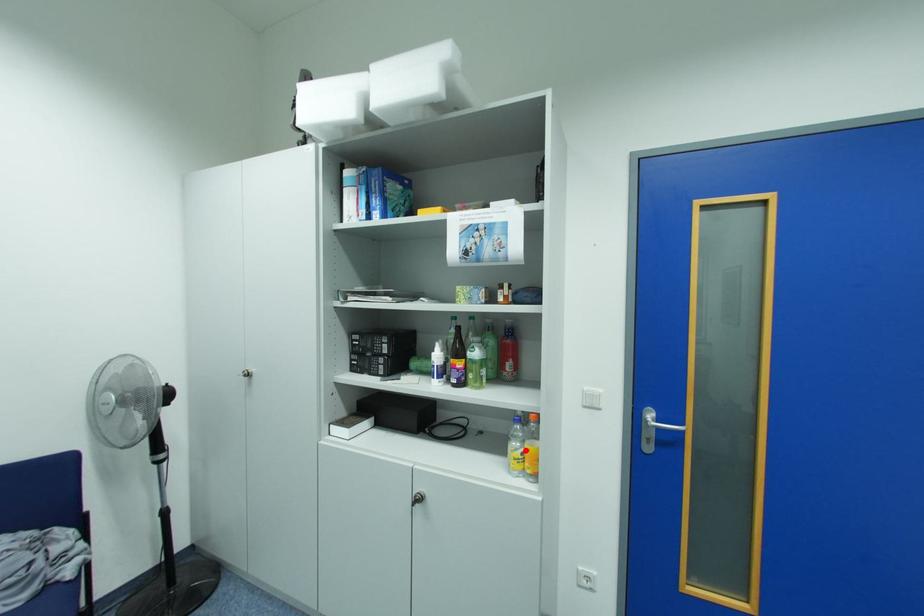
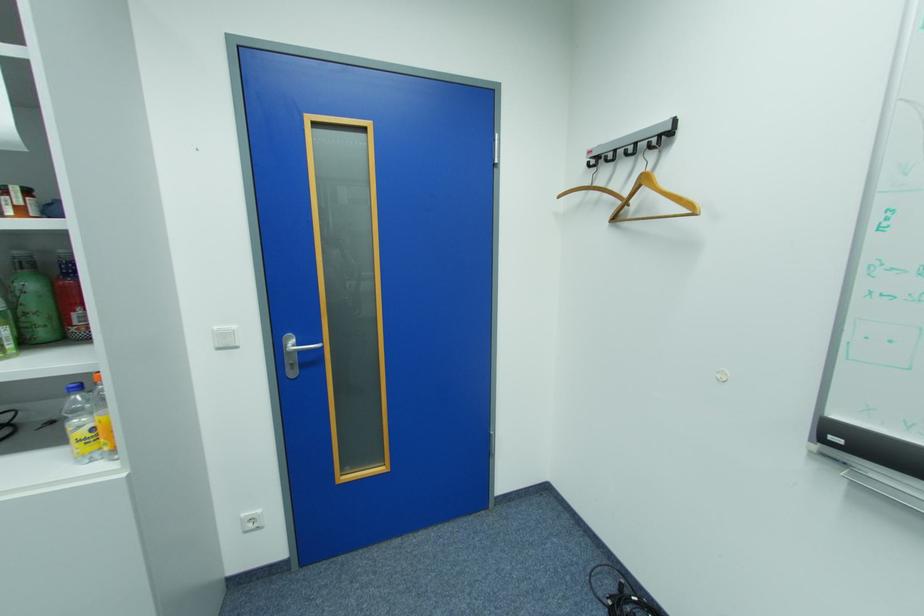
Locate, in the second image, the point that corresponds to the highlighted location in the first image.

(89, 427)